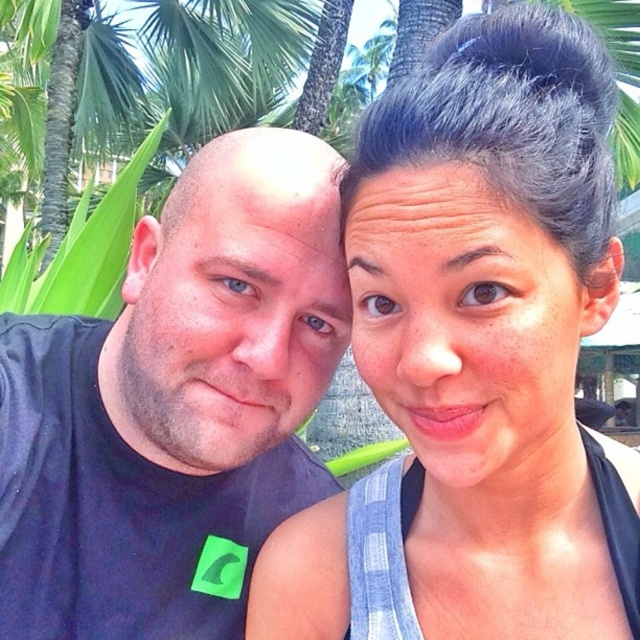
You are a photographer trying to capture a portrait of the two people in the scene. You want to ensure that both the blue plaid shirt at upper right and the smooth skin face at center are clearly visible in the frame. Based on their positions, which object is closer to the right edge of the photo?

The blue plaid shirt at upper right is closer to the right edge of the photo because it is positioned to the right of the smooth skin face at center.

You are a photographer trying to adjust the lighting for a portrait. You notice a point at coordinates (228, 323) in the image. Based on the scene description, what object is located at this point?

The point at coordinates (228, 323) indicates the matte skin face at left.